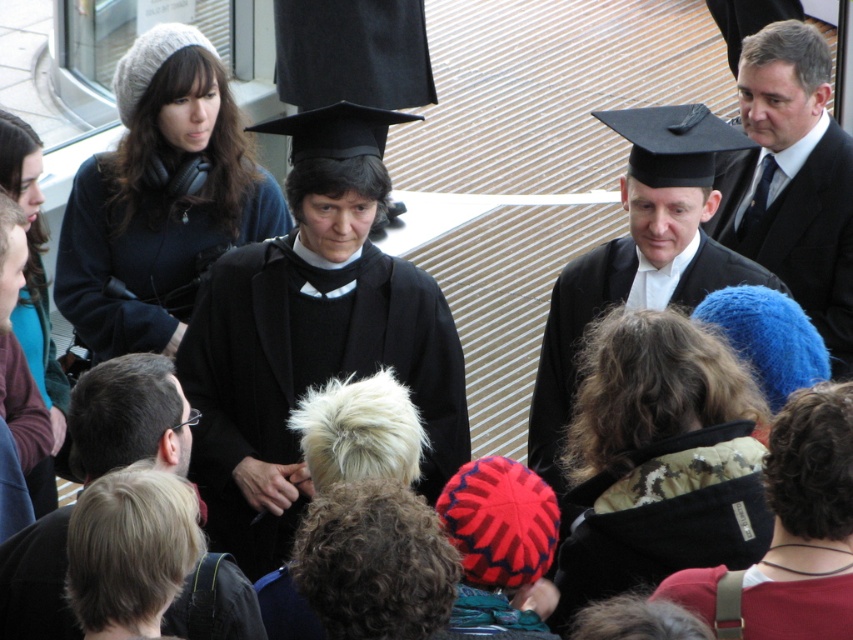
You are a photographer positioned at the camera. You want to take a closeup shot of the matte black graduation gown at center. Considering the distance, will you need to use a zoom lens?

The matte black graduation gown at center is 46.58 feet away from the camera. To capture a closeup shot from this distance, you would need to use a zoom lens to magnify the subject sufficiently.

Consider the image. You are a photographer at the event and need to adjust the camera focus to capture both the matte black graduation gown at center and the black matte suit at upper right in the same frame. Given the camera has a depth of field that can cover objects within a 2.0 meters range, will both subjects be in focus?

The matte black graduation gown at center is 1.87 meters from the black matte suit at upper right. Since the distance between them is within the camera s 2.0 meters depth of field range, both subjects will be in focus.